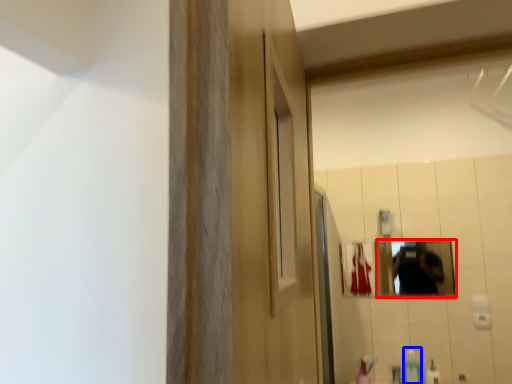
Question: Which of the following is the closest to the observer, mirror (highlighted by a red box) or soap dispenser (highlighted by a blue box)?

Choices:
 (A) mirror
 (B) soap dispenser

Answer: (B)